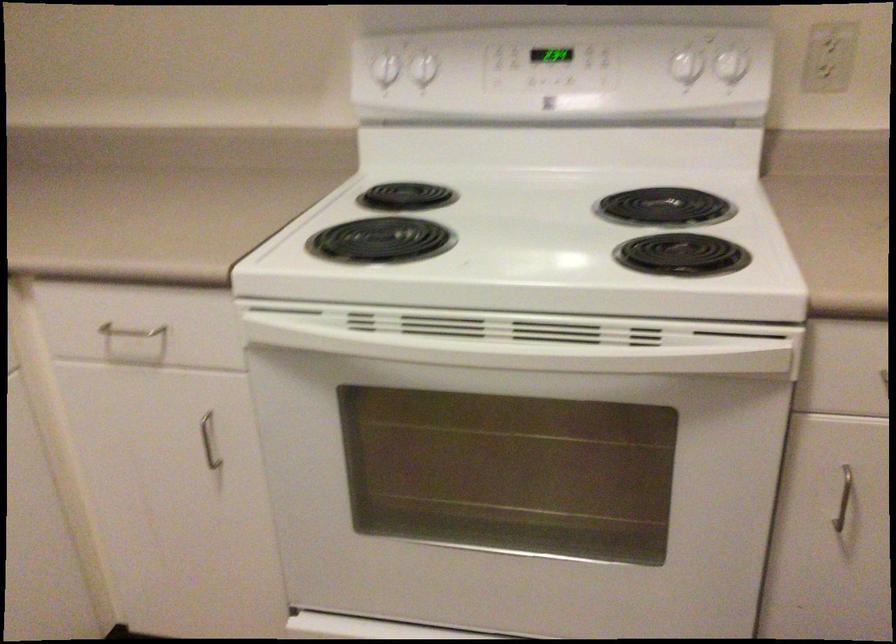
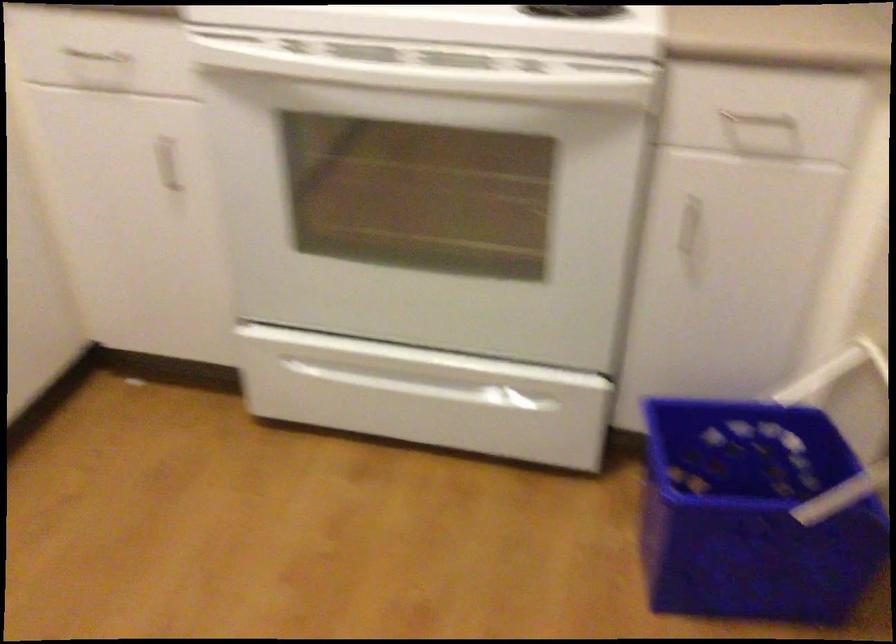
In a continuous first-person perspective shot, in which direction is the camera moving?

The movement direction of the cameraman is right, backward.